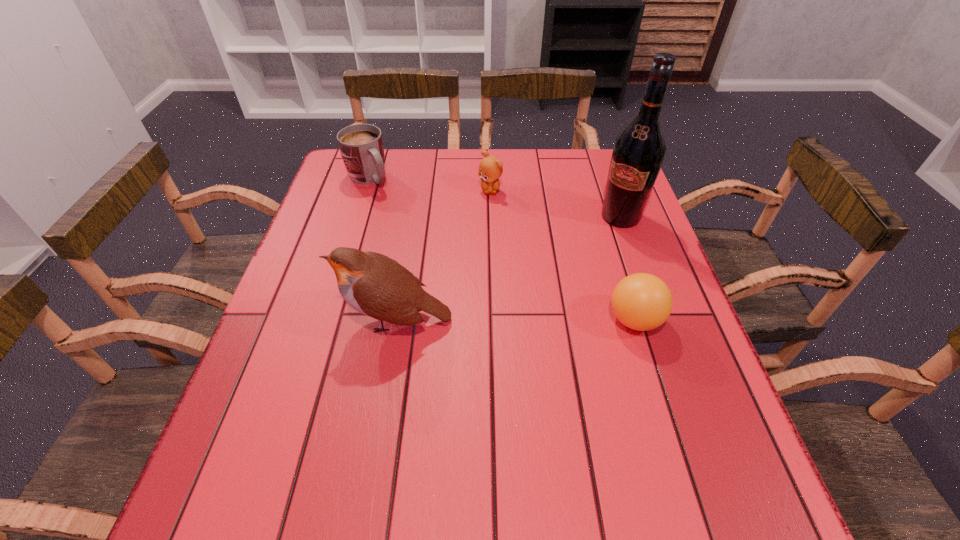
Where is `mug situated at the left edge`? Image resolution: width=960 pixels, height=540 pixels. mug situated at the left edge is located at coordinates (361, 145).

Where is `ping-pong ball at the right edge`? Image resolution: width=960 pixels, height=540 pixels. ping-pong ball at the right edge is located at coordinates (641, 301).

The height and width of the screenshot is (540, 960). Find the location of `wine bottle that is at the right edge`. wine bottle that is at the right edge is located at coordinates click(x=638, y=153).

Image resolution: width=960 pixels, height=540 pixels. What are the coordinates of `object positioned at the far left corner` in the screenshot? It's located at 361,145.

Where is `vacant region at the far edge`? The width and height of the screenshot is (960, 540). vacant region at the far edge is located at coordinates [x=418, y=178].

The height and width of the screenshot is (540, 960). I want to click on vacant space at the near edge of the desktop, so click(506, 424).

Identify the location of vacant space at the left edge of the desktop. The width and height of the screenshot is (960, 540). (320, 208).

The height and width of the screenshot is (540, 960). I want to click on free space at the far left corner of the desktop, so click(x=345, y=192).

This screenshot has width=960, height=540. Find the location of `vacant space at the near left corner`. vacant space at the near left corner is located at coordinates (244, 410).

Find the location of a particular element. The height and width of the screenshot is (540, 960). vacant region between the third farthest object and the second tallest object is located at coordinates (508, 268).